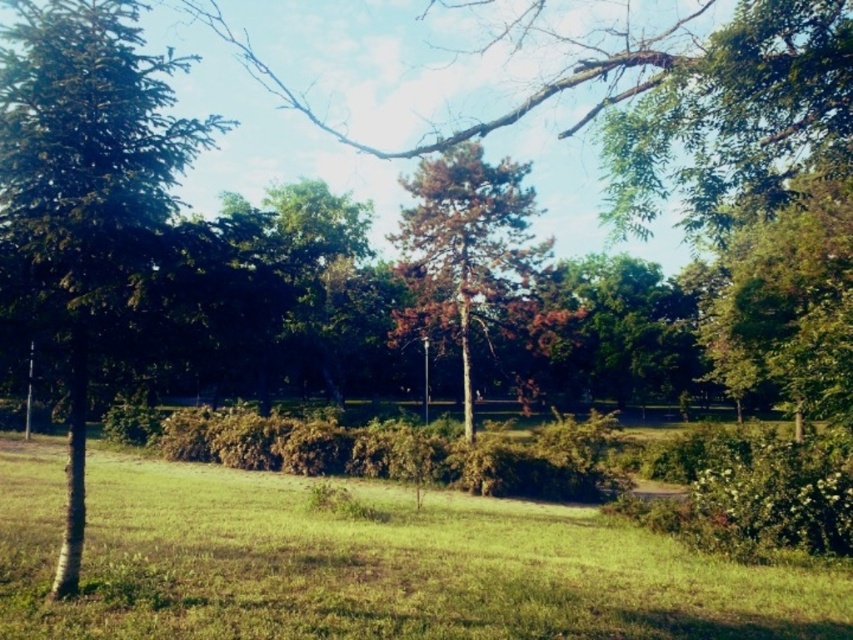
Question: Is green grassy at lower left in front of green leafy tree at left?

Choices:
 (A) no
 (B) yes

Answer: (A)

Question: Does green grassy at lower left come in front of green leafy tree at left?

Choices:
 (A) yes
 (B) no

Answer: (B)

Question: Which point appears farthest from the camera in this image?

Choices:
 (A) (418, 584)
 (B) (422, 236)

Answer: (B)

Question: Which object is positioned closest to the brown textured tree at center?

Choices:
 (A) green leafy tree at left
 (B) green grassy at lower left

Answer: (B)

Question: Can you confirm if green leafy tree at left is bigger than brown textured tree at center?

Choices:
 (A) no
 (B) yes

Answer: (B)

Question: Which is farther from the green grassy at lower left?

Choices:
 (A) brown textured tree at center
 (B) green leafy tree at left

Answer: (A)